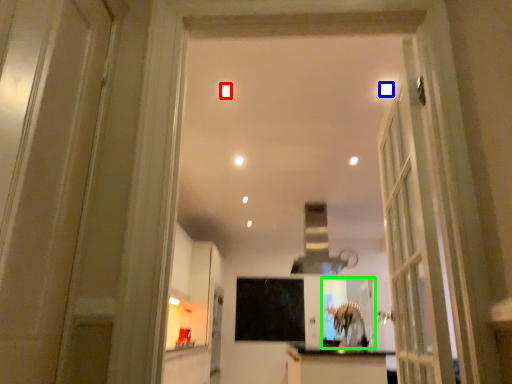
Question: Which is nearer to the lighting (highlighted by a red box)? lighting (highlighted by a blue box) or mirror (highlighted by a green box).

Choices:
 (A) lighting
 (B) mirror

Answer: (A)